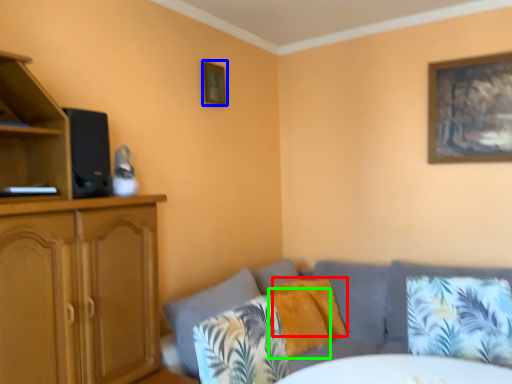
Question: Which object is positioned closest to pillow (highlighted by a red box)? Select from picture frame (highlighted by a blue box) and pillow (highlighted by a green box).

Choices:
 (A) picture frame
 (B) pillow

Answer: (B)